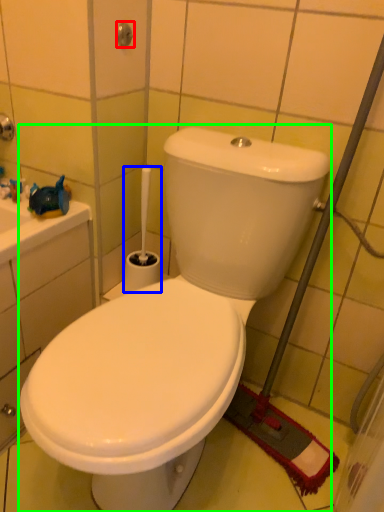
Question: Estimate the real-world distances between objects in this image. Which object is closer to shower (highlighted by a red box), brush (highlighted by a blue box) or toilet (highlighted by a green box)?

Choices:
 (A) brush
 (B) toilet

Answer: (A)